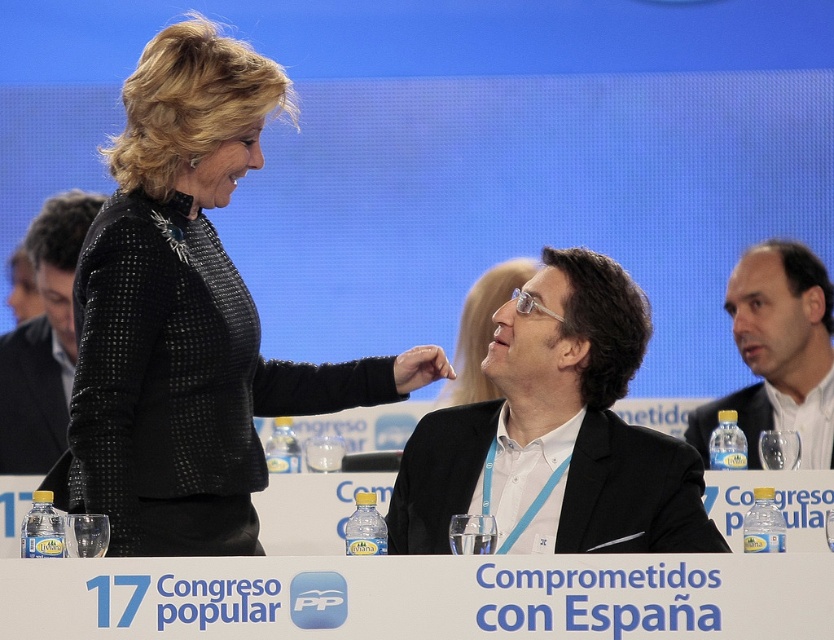
You are organizing a photo shoot for a fashion magazine and need to position two models wearing the black matte suit at center and the black textured blazer at upper left. Based on the scene described, which model should stand on the right side to maintain the original spatial arrangement?

The model wearing the black matte suit at center should stand on the right side because the black matte suit at center is to the right of the black textured blazer at upper left in the original scene.

Consider the image. You are standing in the room where the 17th Congresso Popular is taking place. You notice two points marked in the scene. Which point, point (618, 394) or point (795, 371), is closer to you?

Point (618, 394) is closer to you than point (795, 371).

You are at the 17th Congresso Popular and need to find the black matte suit at center and the black textured blazer at upper left. Which one is closer to you?

The black matte suit at center is closer to you because it is in front of the black textured blazer at upper left.